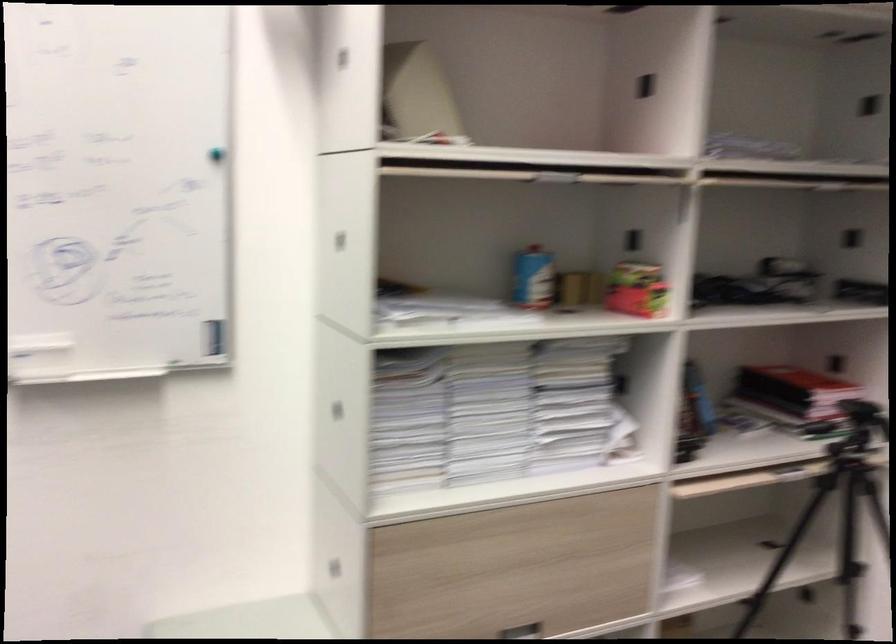
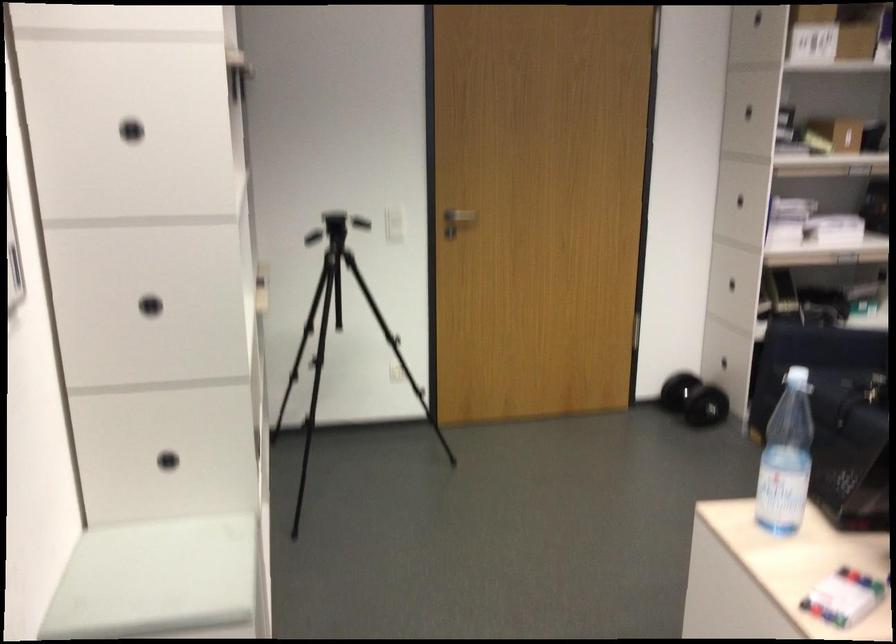
Where in the second image is the point corresponding to point (374, 433) from the first image?

(150, 305)